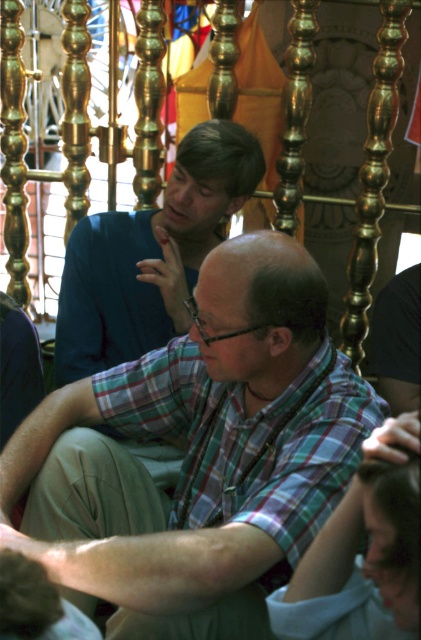
Is point (124, 432) behind point (189, 218)?

No, it is not.

Between plaid cotton shirt at center and plaid shirt at center, which one is positioned lower?

plaid cotton shirt at center is below.

The image size is (421, 640). What do you see at coordinates (197, 445) in the screenshot? I see `plaid cotton shirt at center` at bounding box center [197, 445].

The height and width of the screenshot is (640, 421). What are the coordinates of `plaid cotton shirt at center` in the screenshot? It's located at pyautogui.click(x=197, y=445).